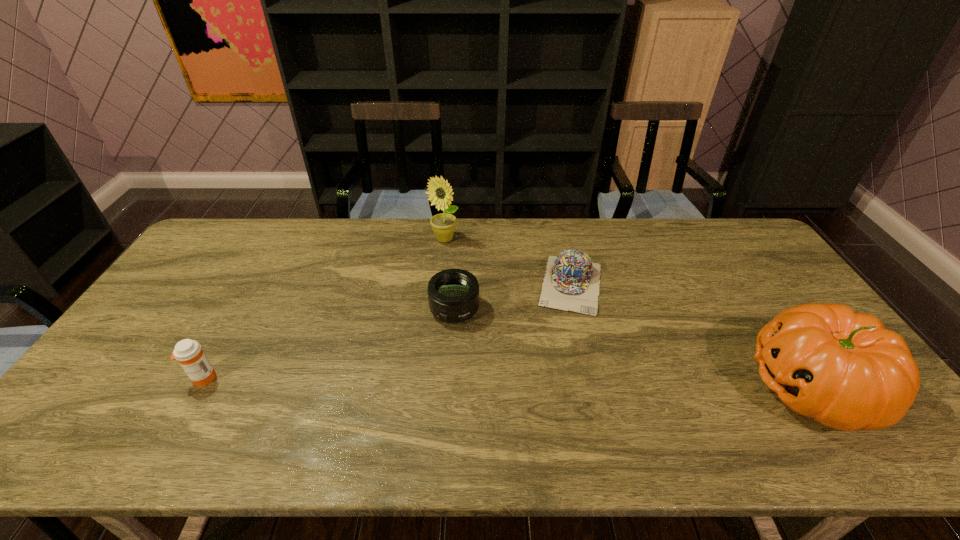
Identify the location of medicine. (189, 353).

Locate an element on the screen. Image resolution: width=960 pixels, height=540 pixels. the leftmost object is located at coordinates (189, 353).

Where is `the rightmost object`? the rightmost object is located at coordinates (844, 369).

This screenshot has height=540, width=960. I want to click on pumpkin, so click(x=844, y=369).

Find the location of `the shortest object`. the shortest object is located at coordinates (571, 283).

Where is `cap`? The image size is (960, 540). cap is located at coordinates (571, 283).

This screenshot has height=540, width=960. I want to click on telephoto lens, so click(x=453, y=294).

Identify the location of sunflower. The height and width of the screenshot is (540, 960). (440, 193).

Where is `vacant space located on the back of the third shortest object`? vacant space located on the back of the third shortest object is located at coordinates (263, 273).

The width and height of the screenshot is (960, 540). In order to click on vacant space located on the carved face of the rightmost object in this screenshot , I will do `click(614, 386)`.